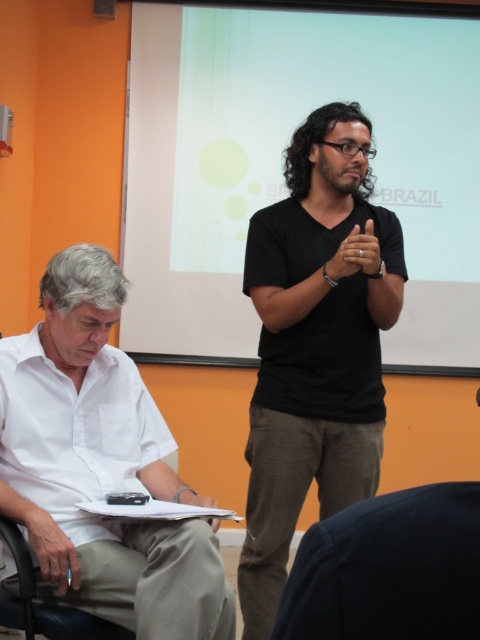
Which is in front, point (372, 307) or point (128, 604)?

Point (128, 604)

Does black matte shirt at center have a smaller size compared to white cotton shirt at left?

Actually, black matte shirt at center might be larger than white cotton shirt at left.

Between point (325, 157) and point (113, 371), which one is positioned behind?

The point (325, 157) is more distant.

Where is `black matte shirt at center`? The height and width of the screenshot is (640, 480). black matte shirt at center is located at coordinates (315, 344).